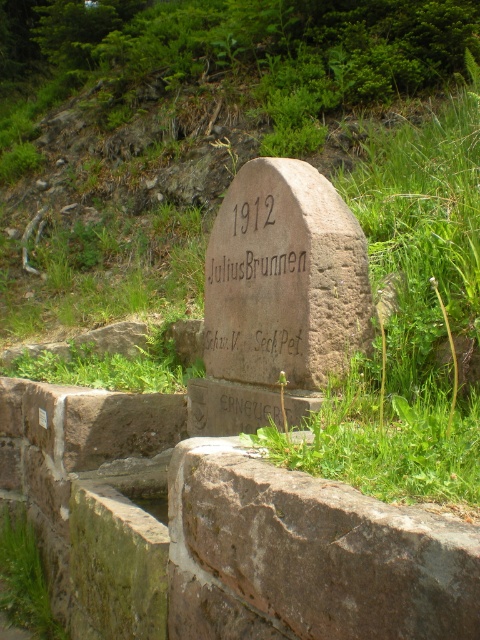
Is brown rough stone at center thinner than brown stone gravestone at center?

Yes.

Is point (229, 573) less distant than point (215, 296)?

Yes.

This screenshot has width=480, height=640. In order to click on brown rough stone at center in this screenshot , I will do `click(307, 556)`.

Is brown rough stone at center bigger than green leafy grass at lower left?

Indeed, brown rough stone at center has a larger size compared to green leafy grass at lower left.

Between brown rough stone at center and green leafy grass at lower left, which one is positioned lower?

green leafy grass at lower left

You are a GUI agent. You are given a task and a screenshot of the screen. Output one action in this format:
    pyautogui.click(x=<x>, y=<y>)
    Task: Click on the brown rough stone at center
    This screenshot has width=480, height=640.
    Given the screenshot: What is the action you would take?
    pyautogui.click(x=307, y=556)

This screenshot has width=480, height=640. What are the coordinates of `brown rough stone at center` in the screenshot? It's located at (307, 556).

Can you confirm if brown stone gravestone at center is positioned to the right of green leafy grass at lower left?

Indeed, brown stone gravestone at center is positioned on the right side of green leafy grass at lower left.

Is brown stone gravestone at center positioned before green leafy grass at lower left?

Yes, it is.

Is point (296, 371) behind point (11, 593)?

No, (296, 371) is closer to viewer.

Where is `brown stone gravestone at center`? Image resolution: width=480 pixels, height=640 pixels. brown stone gravestone at center is located at coordinates (277, 298).